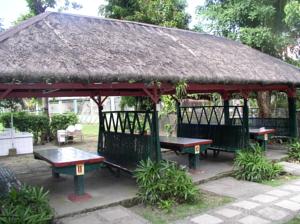
Where is `roof support columns`? roof support columns is located at coordinates (154, 97), (101, 100), (177, 101), (243, 96), (224, 94), (289, 93).